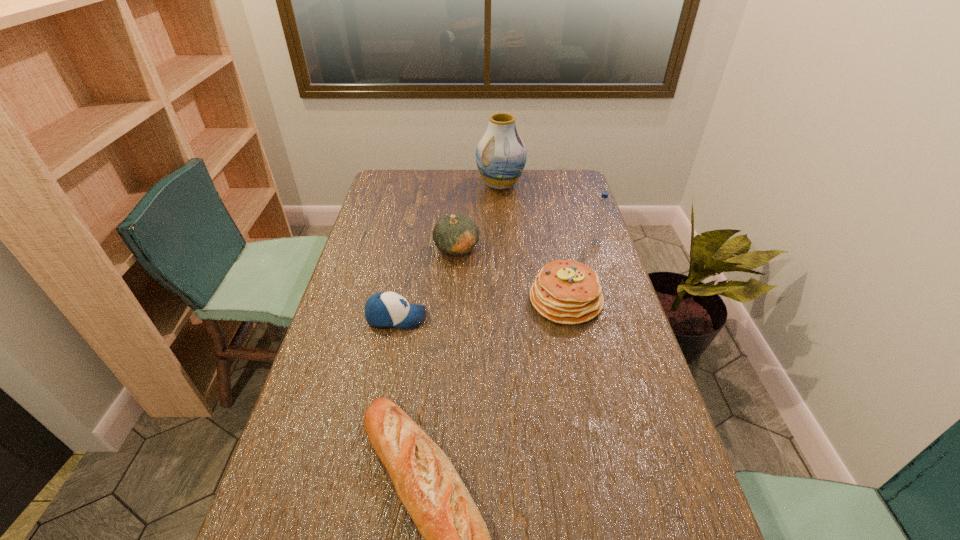
Identify the location of free space between the second tallest object and the baseball cap. (496, 280).

The image size is (960, 540). Identify the location of vacant area that lies between the rightmost object and the baseball cap. (496, 280).

Identify the location of free point between the third shortest object and the gourd. (512, 274).

At what (x,y) coordinates should I click in order to perform the action: click on vacant space that is in between the second tallest object and the gourd. Please return your answer as a coordinate pair (x, y). Looking at the image, I should click on (526, 245).

Identify the location of free point between the baseball cap and the water bottle. (496, 280).

The width and height of the screenshot is (960, 540). Find the location of `object that is the second nearest to the pancake`. object that is the second nearest to the pancake is located at coordinates (458, 234).

Locate an element on the screen. Image resolution: width=960 pixels, height=540 pixels. object that ranks as the closest to the tallest object is located at coordinates (458, 234).

At what (x,y) coordinates should I click in order to perform the action: click on vacant area that satisfies the following two spatial constraints: 1. on the back side of the pancake; 2. on the right side of the rightmost object. Please return your answer as a coordinate pair (x, y). This screenshot has width=960, height=540. Looking at the image, I should click on (554, 241).

The width and height of the screenshot is (960, 540). I want to click on vacant space that satisfies the following two spatial constraints: 1. on the front side of the vase; 2. on the right side of the fourth tallest object, so click(508, 300).